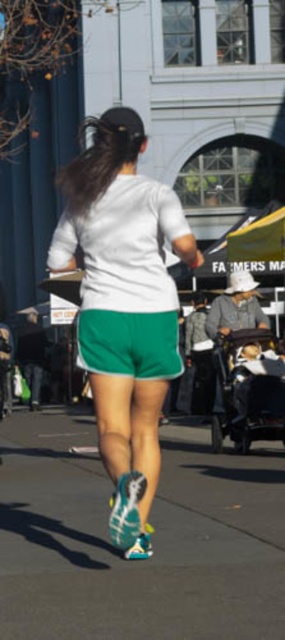
Question: Is gray asphalt at lower center wider than white matte shorts at center?

Choices:
 (A) no
 (B) yes

Answer: (B)

Question: Which object appears closest to the camera in this image?

Choices:
 (A) white matte shorts at center
 (B) gray asphalt at lower center

Answer: (B)

Question: Does gray asphalt at lower center lie in front of white matte shorts at center?

Choices:
 (A) yes
 (B) no

Answer: (A)

Question: Among these points, which one is nearest to the camera?

Choices:
 (A) (149, 256)
 (B) (184, 580)

Answer: (B)

Question: Is gray asphalt at lower center smaller than white matte shorts at center?

Choices:
 (A) yes
 (B) no

Answer: (B)